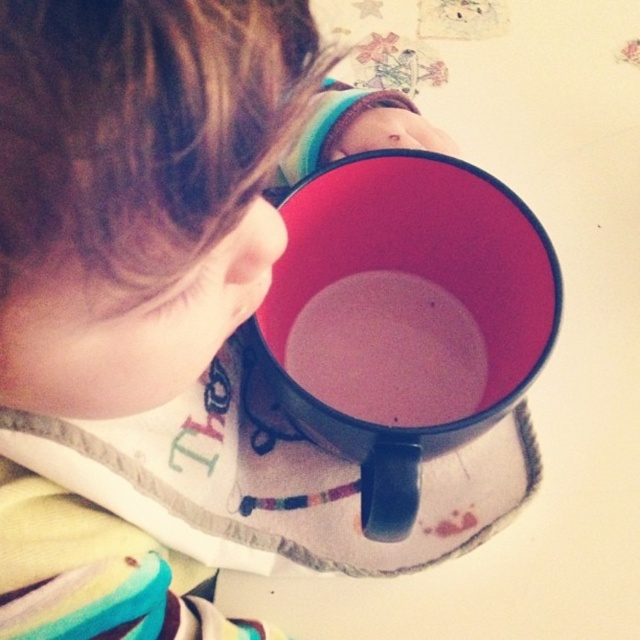
You are a photographer trying to capture the matte black cup at upper center and the matte black mug at center. Which object should you focus on first to ensure it appears sharp in the photo?

You should focus on the matte black cup at upper center first because it is closer to the viewer than the matte black mug at center, so focusing on it will ensure it appears sharp while the mug may be slightly out of focus if the depth of field is limited.

You are a delivery person who needs to place a 15 cm wide box between the matte black cup at upper center and the matte black mug at center. Is there enough space?

The matte black cup at upper center is 16.04 centimeters from the matte black mug at center. Since the box is 15 cm wide, there is enough space to place it between them.

You are a delivery robot approaching the scene. The matte black cup at upper center is an obstacle. Can you safely pass by it if your minimum safe distance is 6 inches?

The matte black cup at upper center is 6.59 inches away from the viewer, which is greater than the minimum safe distance of 6 inches. Therefore, the delivery robot can safely pass by the matte black cup at upper center.